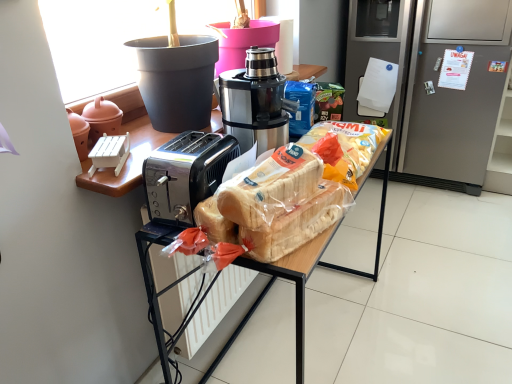
Where is `satin black coffee maker at center`? satin black coffee maker at center is located at coordinates (255, 102).

Describe the element at coordinates (270, 187) in the screenshot. I see `translucent plastic bread at center` at that location.

Describe the element at coordinates (436, 81) in the screenshot. I see `silver metallic refrigerator at right` at that location.

Where is `silver metallic refrigerator at right`? silver metallic refrigerator at right is located at coordinates (436, 81).

What is the approximate height of matte black toaster at center?

It is 29.90 inches.

Identify the location of matte pink pot at left. This screenshot has width=512, height=384. (102, 118).

I want to click on satin black coffee maker at center, so click(255, 102).

Is silver metallic refrigerator at right wider or thinner than matte pink pot at left?

silver metallic refrigerator at right is wider than matte pink pot at left.

From the image's perspective, which is above, silver metallic refrigerator at right or matte pink pot at left?

silver metallic refrigerator at right.

Considering the sizes of objects silver metallic refrigerator at right and matte pink pot at left in the image provided, who is taller, silver metallic refrigerator at right or matte pink pot at left?

With more height is silver metallic refrigerator at right.

From a real-world perspective, relative to matte pink pot at left, is silver metallic refrigerator at right vertically above or below?

silver metallic refrigerator at right is below matte pink pot at left.

Consider the image. From the image's perspective, is matte black toaster at center on matte pink pot at left?

No, from the image's perspective, matte black toaster at center is not over matte pink pot at left.

Can you tell me how much matte black toaster at center and matte pink pot at left differ in facing direction?

The facing directions of matte black toaster at center and matte pink pot at left are 2.73 degrees apart.

Considering the relative sizes of matte black toaster at center and matte pink pot at left in the image provided, is matte black toaster at center shorter than matte pink pot at left?

No.

Which is behind, point (373, 280) or point (496, 92)?

Point (496, 92)

Considering the sizes of matte black toaster at center and silver metallic refrigerator at right in the image, is matte black toaster at center bigger or smaller than silver metallic refrigerator at right?

In the image, matte black toaster at center appears to be smaller than silver metallic refrigerator at right.

Identify the location of desk below the silver metallic refrigerator at right (from the image's perspective). This screenshot has height=384, width=512. (310, 267).

Which of these two, matte black toaster at center or silver metallic refrigerator at right, is wider?

With larger width is silver metallic refrigerator at right.

In terms of size, does satin black coffee maker at center appear bigger or smaller than translucent plastic bread at center?

Clearly, satin black coffee maker at center is larger in size than translucent plastic bread at center.

In the scene shown: Considering the sizes of objects satin black coffee maker at center and translucent plastic bread at center in the image provided, who is shorter, satin black coffee maker at center or translucent plastic bread at center?

translucent plastic bread at center is shorter.

Is satin black coffee maker at center positioned beyond the bounds of translucent plastic bread at center?

Yes, satin black coffee maker at center is not within translucent plastic bread at center.

How many degrees apart are the facing directions of translucent plastic bread at center and silver metallic refrigerator at right?

74 degrees.

Is translucent plastic bread at center touching silver metallic refrigerator at right?

No, translucent plastic bread at center is not touching silver metallic refrigerator at right.

Is translucent plastic bread at center situated inside silver metallic refrigerator at right or outside?

translucent plastic bread at center is not enclosed by silver metallic refrigerator at right.

Does translucent plastic bread at center have a lesser height compared to silver metallic refrigerator at right?

Indeed, translucent plastic bread at center has a lesser height compared to silver metallic refrigerator at right.

Can you confirm if translucent plastic bread at center is smaller than matte pink pot at left?

Actually, translucent plastic bread at center might be larger than matte pink pot at left.

From a real-world perspective, is translucent plastic bread at center physically below matte pink pot at left?

Yes, from a real-world perspective, translucent plastic bread at center is below matte pink pot at left.

Does translucent plastic bread at center have a greater width compared to matte pink pot at left?

Correct, the width of translucent plastic bread at center exceeds that of matte pink pot at left.

Can you tell me how much translucent plastic bread at center and matte pink pot at left differ in facing direction?

14.8 degrees.

Is silver metallic refrigerator at right situated inside translucent plastic bread at center or outside?

silver metallic refrigerator at right is not enclosed by translucent plastic bread at center.

How many degrees apart are the facing directions of silver metallic refrigerator at right and translucent plastic bread at center?

74 degrees.

Which of these two, silver metallic refrigerator at right or translucent plastic bread at center, stands shorter?

translucent plastic bread at center.

From the image's perspective, is silver metallic refrigerator at right located above or below translucent plastic bread at center?

silver metallic refrigerator at right is situated higher than translucent plastic bread at center in the image.

This screenshot has height=384, width=512. I want to click on home appliance located underneath the matte pink pot at left (from a real-world perspective), so click(436, 81).

At what (x,y) coordinates should I click in order to perform the action: click on appliance above the matte black toaster at center (from the image's perspective). Please return your answer as a coordinate pair (x, y). This screenshot has width=512, height=384. Looking at the image, I should click on (102, 118).

Which object lies further to the anchor point matte pink pot at left, silver metallic refrigerator at right or translucent plastic bread at center?

silver metallic refrigerator at right is positioned further to the anchor matte pink pot at left.

Estimate the real-world distances between objects in this image. Which object is closer to matte pink pot at left, satin black coffee maker at center or silver metallic refrigerator at right?

Among the two, satin black coffee maker at center is located nearer to matte pink pot at left.

From the image, which object appears to be nearer to matte pink pot at left, translucent plastic bread at center or satin black coffee maker at center?

The object closer to matte pink pot at left is satin black coffee maker at center.

When comparing their distances from translucent plastic bread at center, does matte black toaster at center or matte pink pot at left seem further?

matte pink pot at left.

Estimate the real-world distances between objects in this image. Which object is closer to matte black toaster at center, matte pink pot at left or satin black coffee maker at center?

Based on the image, satin black coffee maker at center appears to be nearer to matte black toaster at center.

When comparing their distances from translucent plastic bread at center, does matte pink pot at left or satin black coffee maker at center seem closer?

satin black coffee maker at center is positioned closer to the anchor translucent plastic bread at center.

Looking at this image, based on their spatial positions, is silver metallic refrigerator at right or translucent plastic bread at center further from matte black toaster at center?

silver metallic refrigerator at right.

Estimate the real-world distances between objects in this image. Which object is further from silver metallic refrigerator at right, matte pink pot at left or matte black toaster at center?

matte pink pot at left lies further to silver metallic refrigerator at right than the other object.

This screenshot has width=512, height=384. What are the coordinates of `desk situated between matte pink pot at left and silver metallic refrigerator at right from left to right` in the screenshot? It's located at (310, 267).

Locate an element on the screen. The width and height of the screenshot is (512, 384). desk between translucent plastic bread at center and silver metallic refrigerator at right from front to back is located at coordinates (310, 267).

This screenshot has height=384, width=512. What are the coordinates of `snack between matte pink pot at left and silver metallic refrigerator at right` in the screenshot? It's located at (270, 187).

The image size is (512, 384). What are the coordinates of `coffee maker situated between matte pink pot at left and translucent plastic bread at center from left to right` in the screenshot? It's located at (255, 102).